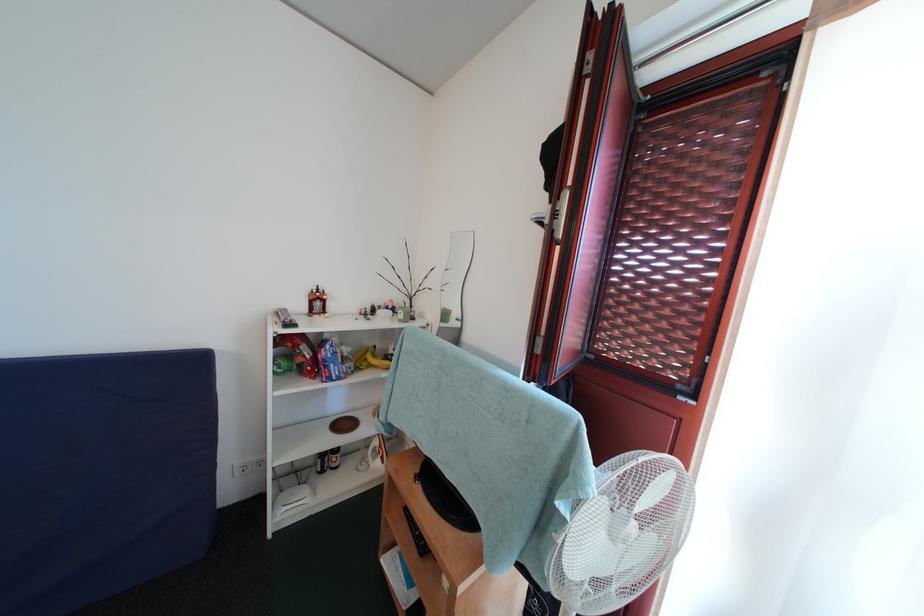
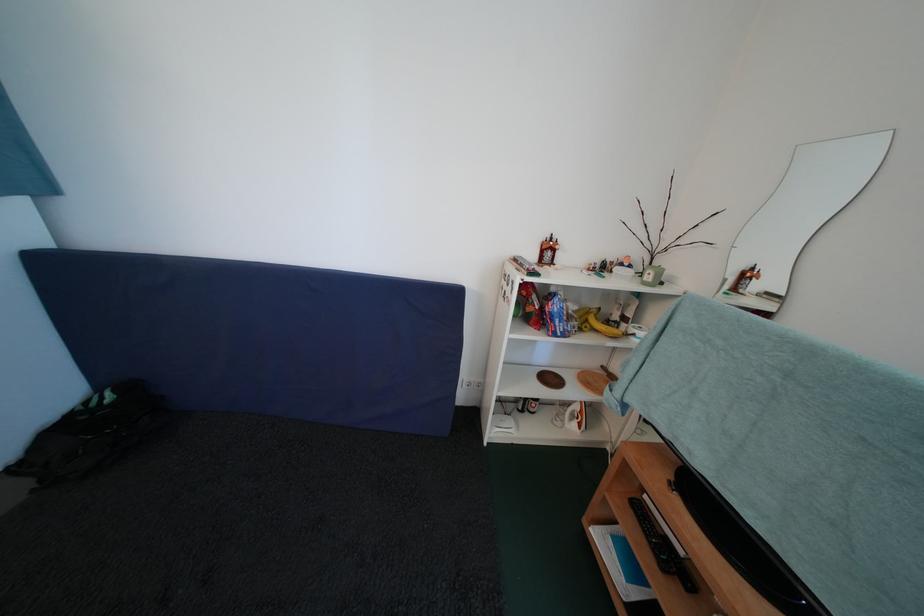
In the second image, find the point that corresponds to point (307, 312) in the first image.

(539, 261)